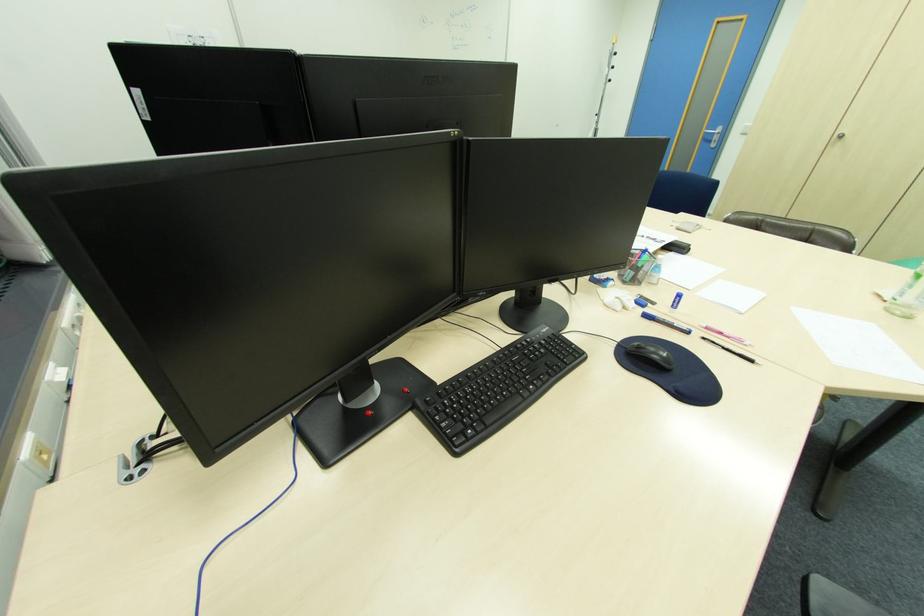
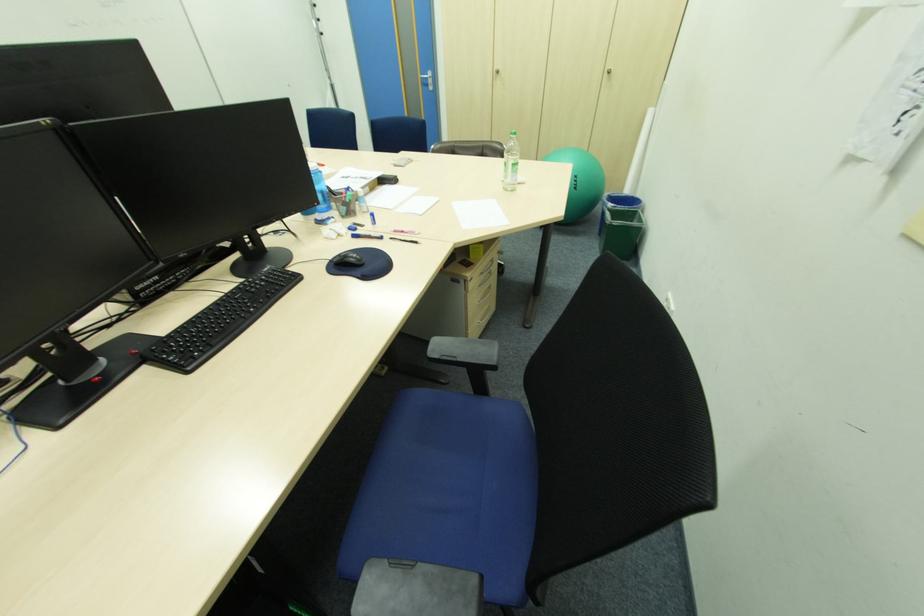
Locate, in the second image, the point that corresponds to point 637,274 in the first image.

(349, 209)